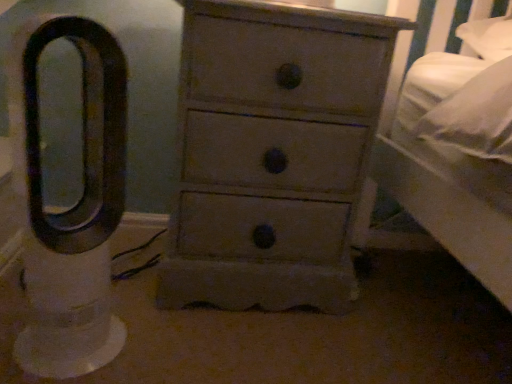
The width and height of the screenshot is (512, 384). Describe the element at coordinates (72, 207) in the screenshot. I see `white plastic fan at left` at that location.

You are a GUI agent. You are given a task and a screenshot of the screen. Output one action in this format:
    pyautogui.click(x=<x>, y=<y>)
    Task: Click on the white plastic fan at left
    This screenshot has width=512, height=384.
    Given the screenshot: What is the action you would take?
    pyautogui.click(x=72, y=207)

Find the location of a particular element. Image resolution: width=512 pixels, height=384 pixels. matte gray chest of drawers at center is located at coordinates (272, 153).

Describe the element at coordinates (272, 153) in the screenshot. The width and height of the screenshot is (512, 384). I see `matte gray chest of drawers at center` at that location.

Measure the distance between matte gray chest of drawers at center and camera.

They are 30.08 inches apart.

Locate an element on the screen. The height and width of the screenshot is (384, 512). white plastic fan at left is located at coordinates (72, 207).

Considering the positions of objects matte gray chest of drawers at center and white plastic fan at left in the image provided, who is more to the left, matte gray chest of drawers at center or white plastic fan at left?

white plastic fan at left is more to the left.

Is the depth of matte gray chest of drawers at center less than that of white plastic fan at left?

No, matte gray chest of drawers at center is further to the viewer.

Which point is more distant from viewer, (273,23) or (83,28)?

Positioned behind is point (273,23).

From the image's perspective, is matte gray chest of drawers at center below white plastic fan at left?

Actually, matte gray chest of drawers at center appears above white plastic fan at left in the image.

From a real-world perspective, which is physically below, matte gray chest of drawers at center or white plastic fan at left?

Result: From a 3D spatial view, white plastic fan at left is below.

Is matte gray chest of drawers at center thinner than white plastic fan at left?

In fact, matte gray chest of drawers at center might be wider than white plastic fan at left.

Who is taller, matte gray chest of drawers at center or white plastic fan at left?

Standing taller between the two is matte gray chest of drawers at center.

Who is smaller, matte gray chest of drawers at center or white plastic fan at left?

With smaller size is white plastic fan at left.

Is matte gray chest of drawers at center inside or outside of white plastic fan at left?

matte gray chest of drawers at center exists outside the volume of white plastic fan at left.

From the picture: Is matte gray chest of drawers at center positioned far away from white plastic fan at left?

matte gray chest of drawers at center is near white plastic fan at left, not far away.

Is matte gray chest of drawers at center positioned with its back to white plastic fan at left?

No, matte gray chest of drawers at center is not facing away from white plastic fan at left.

You are a GUI agent. You are given a task and a screenshot of the screen. Output one action in this format:
    pyautogui.click(x=<x>, y=<y>)
    Task: Click on the chest of drawers above the white plastic fan at left (from the image's perspective)
    This screenshot has height=384, width=512.
    Given the screenshot: What is the action you would take?
    pyautogui.click(x=272, y=153)

Between white plastic fan at left and matte gray chest of drawers at center, which one appears on the left side from the viewer's perspective?

white plastic fan at left is more to the left.

Which object is closer to the camera taking this photo, white plastic fan at left or matte gray chest of drawers at center?

white plastic fan at left.

Considering the positions of point (74, 368) and point (351, 42), is point (74, 368) closer or farther from the camera than point (351, 42)?

Point (74, 368).

From the image's perspective, relative to matte gray chest of drawers at center, is white plastic fan at left above or below?

white plastic fan at left is situated lower than matte gray chest of drawers at center in the image.

From a real-world perspective, which object rests below the other?

In real-world perspective, white plastic fan at left is lower.

Between white plastic fan at left and matte gray chest of drawers at center, which one has larger width?

With larger width is matte gray chest of drawers at center.

Does white plastic fan at left have a greater height compared to matte gray chest of drawers at center?

No.

Can you confirm if white plastic fan at left is smaller than matte gray chest of drawers at center?

Correct, white plastic fan at left occupies less space than matte gray chest of drawers at center.

Is white plastic fan at left spatially inside matte gray chest of drawers at center, or outside of it?

white plastic fan at left is located beyond the bounds of matte gray chest of drawers at center.

Is white plastic fan at left not near matte gray chest of drawers at center?

No, there isn't a large distance between white plastic fan at left and matte gray chest of drawers at center.

Could you tell me if white plastic fan at left is facing matte gray chest of drawers at center?

No, white plastic fan at left is not oriented towards matte gray chest of drawers at center.

Where is `swivel chair below the matte gray chest of drawers at center (from the image's perspective)`? The image size is (512, 384). swivel chair below the matte gray chest of drawers at center (from the image's perspective) is located at coordinates (72, 207).

Identify the location of swivel chair on the left of matte gray chest of drawers at center. The height and width of the screenshot is (384, 512). (72, 207).

There is a white plastic fan at left. Where is `the chest of drawers above it (from a real-world perspective)`? Image resolution: width=512 pixels, height=384 pixels. the chest of drawers above it (from a real-world perspective) is located at coordinates (272, 153).